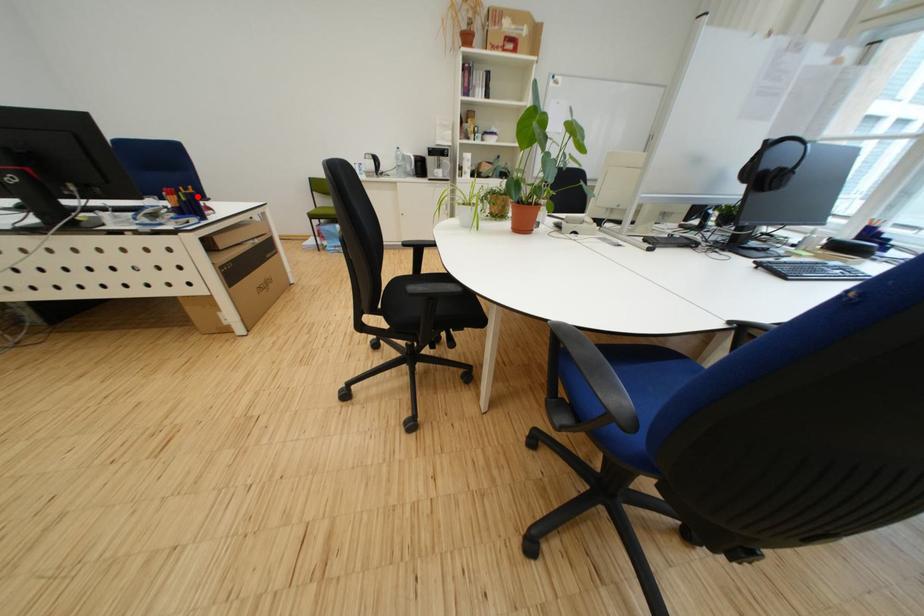
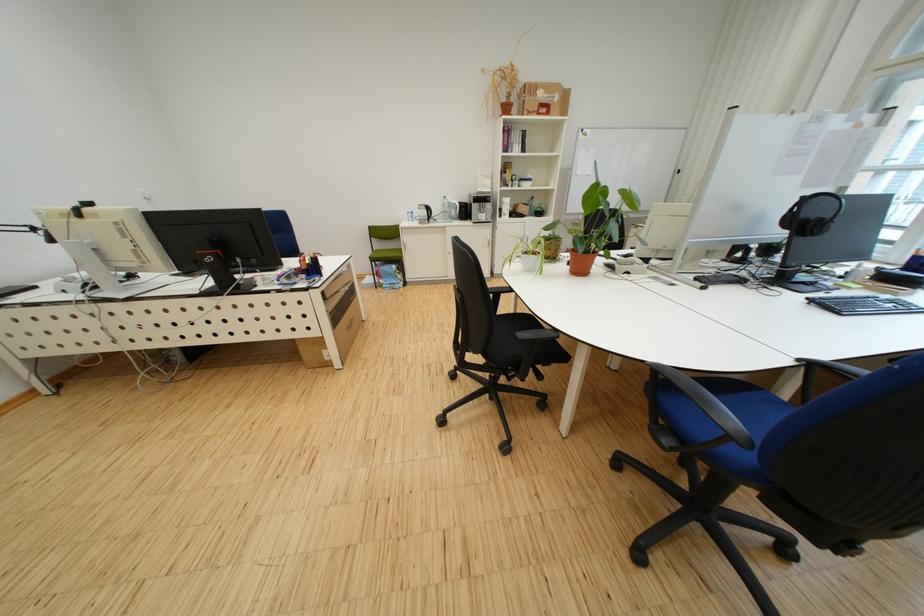
Question: I am providing you with two images of the same scene from different viewpoints. A red point is marked on the first image. Is the red point's position out of view in image 2?

Choices:
 (A) Yes
 (B) No

Answer: (A)